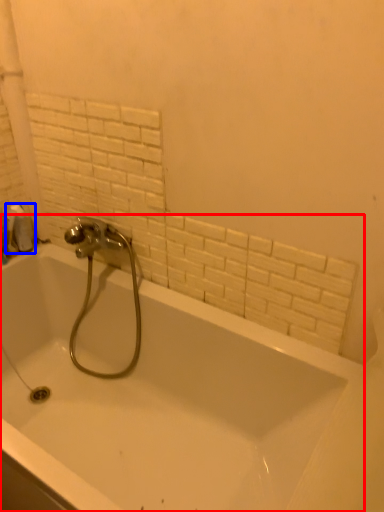
Question: Which of the following is the farthest to the observer, bathtub (highlighted by a red box) or toilet paper (highlighted by a blue box)?

Choices:
 (A) bathtub
 (B) toilet paper

Answer: (B)